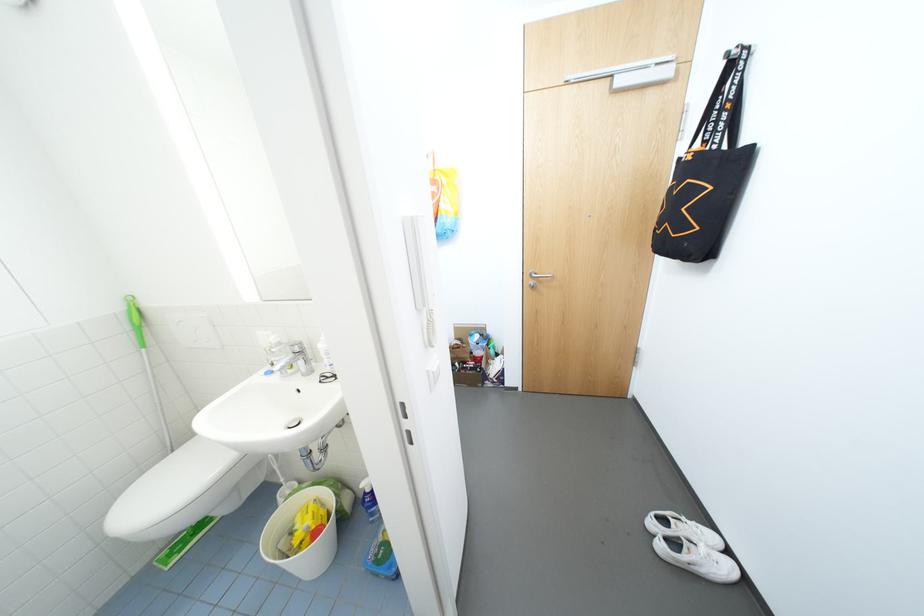
The image size is (924, 616). Identify the location of green handled squeegee. (148, 365).